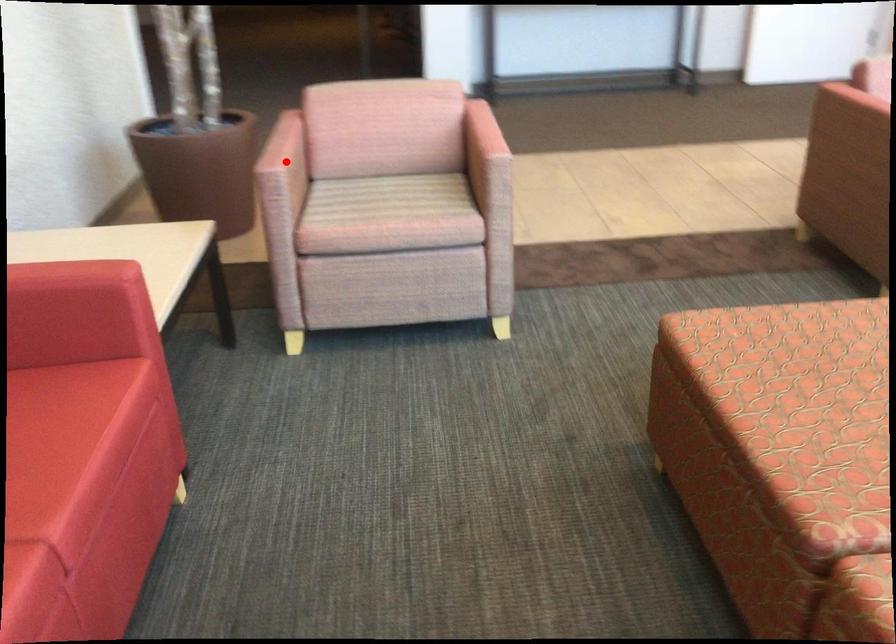
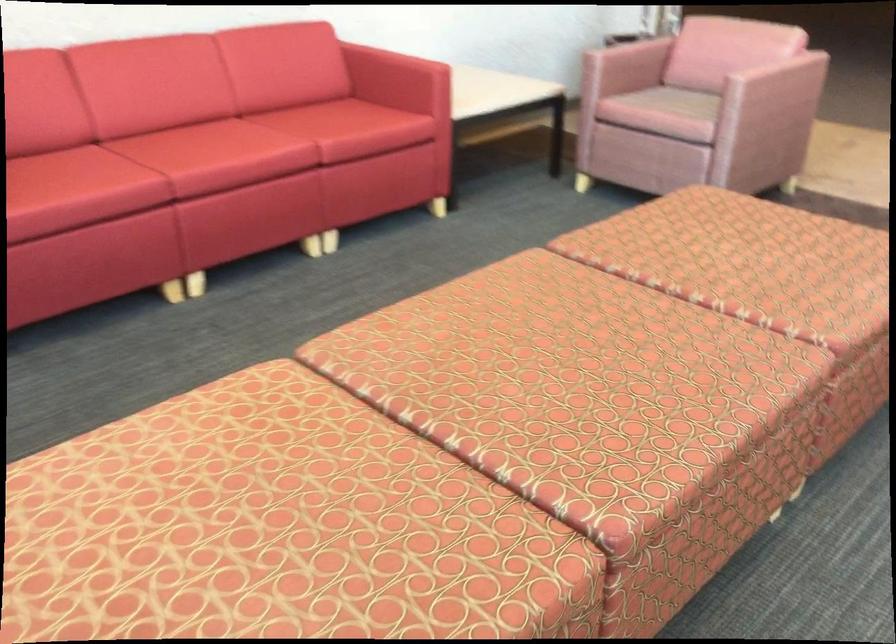
Question: I am providing you with two images of the same scene from different viewpoints. Image1 has a red point marked. In image2, the corresponding 3D location appears at what relative position? Reply with the corresponding letter.

Choices:
 (A) Closer
 (B) Farther

Answer: (B)